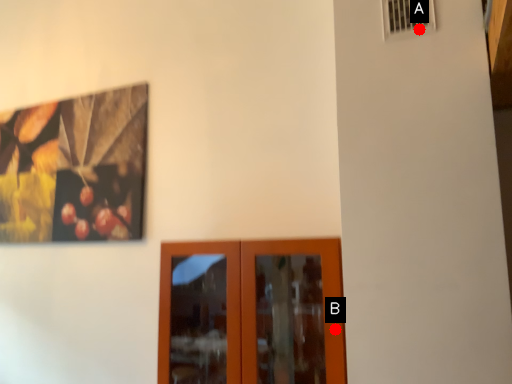
Question: Two points are circled on the image, labeled by A and B beside each circle. Which point appears closest to the camera in this image?

Choices:
 (A) A is closer
 (B) B is closer

Answer: (A)